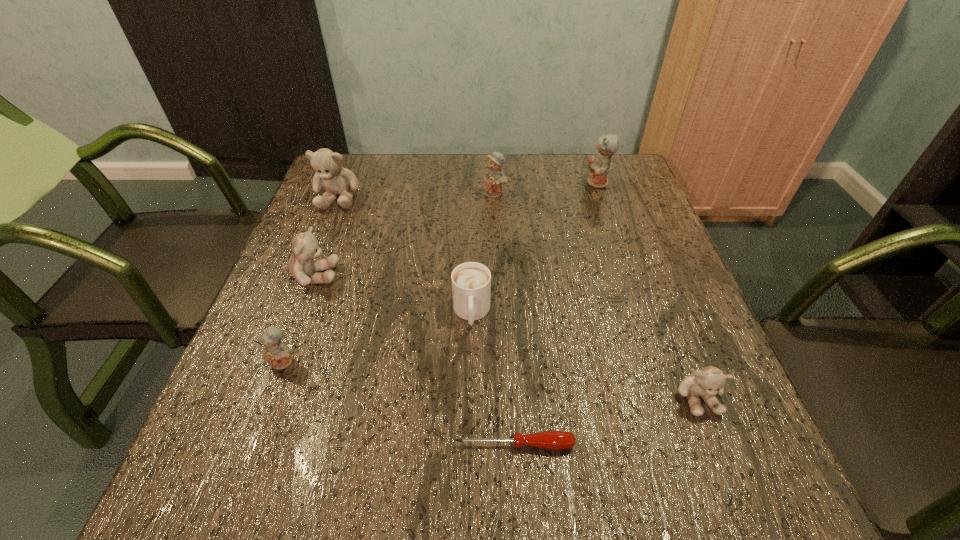
Where is `vacant space positioned 0.240m on the side with the handle of the fifth farthest object`? Image resolution: width=960 pixels, height=540 pixels. vacant space positioned 0.240m on the side with the handle of the fifth farthest object is located at coordinates (469, 456).

The width and height of the screenshot is (960, 540). What are the coordinates of `vacant space located on the front-facing side of the leftmost blue teddy bear` in the screenshot? It's located at (255, 439).

At what (x,y) coordinates should I click in order to perform the action: click on vacant region located 0.120m on the face of the rightmost gray teddy bear. Please return your answer as a coordinate pair (x, y). The width and height of the screenshot is (960, 540). Looking at the image, I should click on (736, 495).

At what (x,y) coordinates should I click in order to perform the action: click on free space located on the left of the red screwdriver. Please return your answer as a coordinate pair (x, y). This screenshot has height=540, width=960. Looking at the image, I should click on (339, 444).

You are a GUI agent. You are given a task and a screenshot of the screen. Output one action in this format:
    pyautogui.click(x=<x>, y=<y>)
    Task: Click on the object present at the near edge
    
    Given the screenshot: What is the action you would take?
    pyautogui.click(x=554, y=440)

Find the location of `object present at the far left corner`. object present at the far left corner is located at coordinates (336, 180).

Locate an element on the screen. object that is at the far right corner is located at coordinates (599, 165).

Find the location of `vacant space at the far edge of the desktop`. vacant space at the far edge of the desktop is located at coordinates (520, 172).

In the image, there is a desktop. Find the location of `blank space at the near edge`. blank space at the near edge is located at coordinates (503, 483).

Identify the location of vacant space at the left edge of the desktop. The width and height of the screenshot is (960, 540). (306, 219).